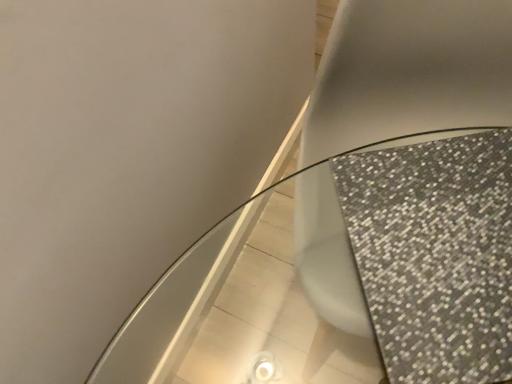
The image size is (512, 384). I want to click on sparkly glass table at center, so click(352, 276).

What is the approximate width of sparkly glass table at center?

sparkly glass table at center is 43.28 centimeters wide.

The height and width of the screenshot is (384, 512). Describe the element at coordinates (352, 276) in the screenshot. I see `sparkly glass table at center` at that location.

What do you see at coordinates (409, 72) in the screenshot? The height and width of the screenshot is (384, 512). I see `matte gray toilet at center` at bounding box center [409, 72].

Where is `matte gray toilet at center`? matte gray toilet at center is located at coordinates (409, 72).

Locate an element on the screen. sparkly glass table at center is located at coordinates (352, 276).

Can you confirm if sparkly glass table at center is positioned to the left of matte gray toilet at center?

Correct, you'll find sparkly glass table at center to the left of matte gray toilet at center.

Which is behind, sparkly glass table at center or matte gray toilet at center?

Positioned behind is matte gray toilet at center.

Which is in front, point (469, 154) or point (507, 116)?

The point (469, 154) is more forward.

From the image's perspective, is sparkly glass table at center beneath matte gray toilet at center?

Yes, from the image's perspective, sparkly glass table at center is below matte gray toilet at center.

From a real-world perspective, does sparkly glass table at center stand above matte gray toilet at center?

Actually, sparkly glass table at center is physically below matte gray toilet at center in the real world.

Based on the photo, is sparkly glass table at center wider or thinner than matte gray toilet at center?

In the image, sparkly glass table at center appears to be more narrow than matte gray toilet at center.

Between sparkly glass table at center and matte gray toilet at center, which one has less height?

sparkly glass table at center.

Which of these two, sparkly glass table at center or matte gray toilet at center, is bigger?

matte gray toilet at center.

Would you say sparkly glass table at center is outside matte gray toilet at center?

That's incorrect, sparkly glass table at center is not completely outside matte gray toilet at center.

Is sparkly glass table at center next to matte gray toilet at center and touching it?

No, sparkly glass table at center is not in contact with matte gray toilet at center.

Is sparkly glass table at center looking in the opposite direction of matte gray toilet at center?

Yes.

How much distance is there between sparkly glass table at center and matte gray toilet at center?

A distance of 14.69 inches exists between sparkly glass table at center and matte gray toilet at center.

You are a GUI agent. You are given a task and a screenshot of the screen. Output one action in this format:
    pyautogui.click(x=<x>, y=<y>)
    Task: Click on the round table on the left of the matte gray toilet at center
    The height and width of the screenshot is (384, 512).
    Given the screenshot: What is the action you would take?
    pyautogui.click(x=352, y=276)

Between matte gray toilet at center and sparkly glass table at center, which one appears on the left side from the viewer's perspective?

From the viewer's perspective, sparkly glass table at center appears more on the left side.

Does matte gray toilet at center come in front of sparkly glass table at center?

No, it is not.

Is point (441, 68) farther from camera compared to point (446, 367)?

Yes, point (441, 68) is farther from viewer.

From the image's perspective, which object appears higher, matte gray toilet at center or sparkly glass table at center?

From the image's view, matte gray toilet at center is above.

From a real-world perspective, is matte gray toilet at center physically below sparkly glass table at center?

No, from a real-world perspective, matte gray toilet at center is not beneath sparkly glass table at center.

Does matte gray toilet at center have a greater width compared to sparkly glass table at center?

Correct, the width of matte gray toilet at center exceeds that of sparkly glass table at center.

Is matte gray toilet at center shorter than sparkly glass table at center?

Incorrect, the height of matte gray toilet at center does not fall short of that of sparkly glass table at center.

Which of these two, matte gray toilet at center or sparkly glass table at center, is smaller?

sparkly glass table at center.

Does matte gray toilet at center contain sparkly glass table at center?

Yes, sparkly glass table at center is inside matte gray toilet at center.

Is matte gray toilet at center placed right next to sparkly glass table at center?

No, matte gray toilet at center is not beside sparkly glass table at center.

Is matte gray toilet at center positioned with its back to sparkly glass table at center?

That's right, matte gray toilet at center is facing away from sparkly glass table at center.

Can you tell me how much matte gray toilet at center and sparkly glass table at center differ in facing direction?

matte gray toilet at center and sparkly glass table at center are facing 167 degrees away from each other.

How much distance is there between matte gray toilet at center and sparkly glass table at center?

The distance of matte gray toilet at center from sparkly glass table at center is 14.69 inches.

This screenshot has height=384, width=512. Identify the location of toilet on the right of sparkly glass table at center. (409, 72).

Where is `toilet above the sparkly glass table at center (from a real-world perspective)`? The width and height of the screenshot is (512, 384). toilet above the sparkly glass table at center (from a real-world perspective) is located at coordinates (x=409, y=72).

Image resolution: width=512 pixels, height=384 pixels. I want to click on toilet above the sparkly glass table at center (from the image's perspective), so click(409, 72).